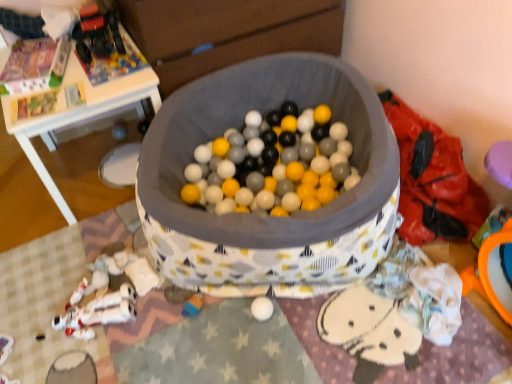
In order to click on vacant space to the right of white matte plastic toy at lower left, the 3th toy positioned from the bottom in this screenshot , I will do `click(161, 295)`.